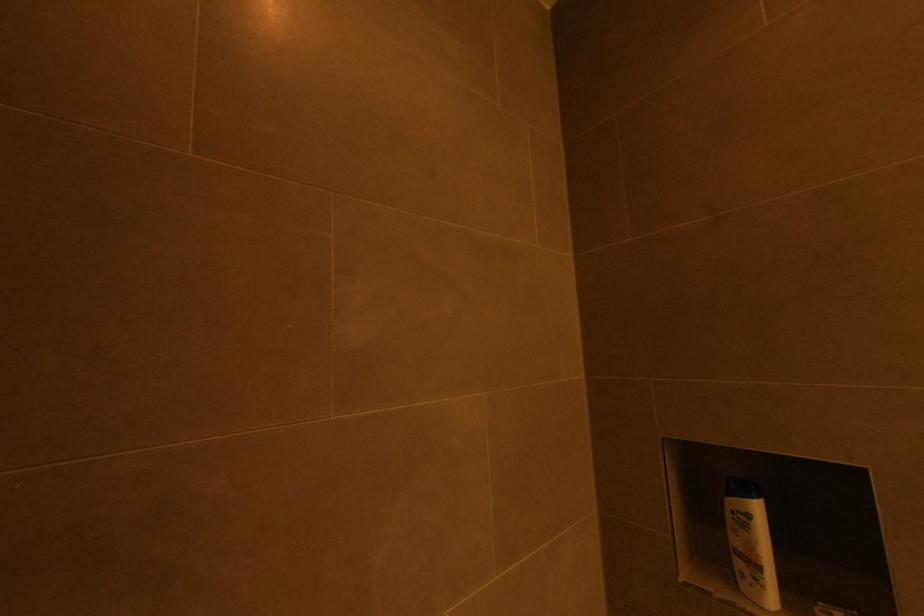
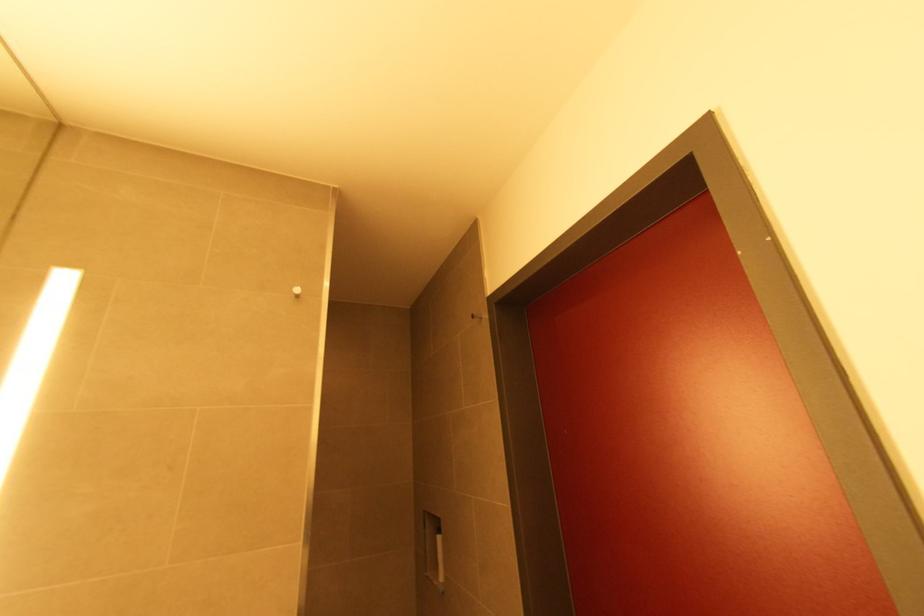
In a continuous first-person perspective shot, in which direction is the camera moving?

The cameraman moved toward right, backward.